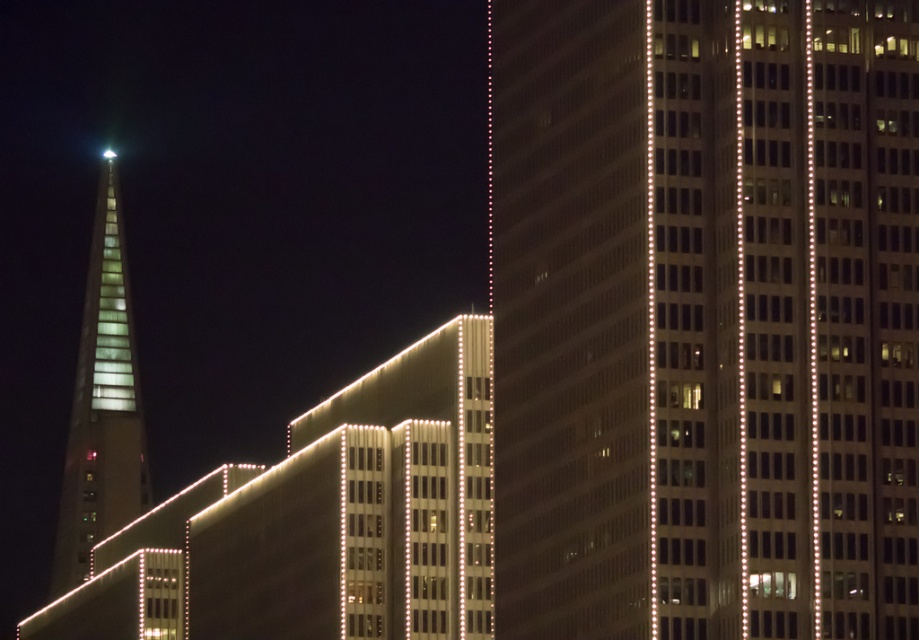
Question: Is glassy reflective skyscraper at center to the left of translucent glass tower at left from the viewer's perspective?

Choices:
 (A) no
 (B) yes

Answer: (A)

Question: Which point is farther from the camera taking this photo?

Choices:
 (A) (109, 154)
 (B) (650, 304)

Answer: (A)

Question: Does translucent glass tower at left appear on the right side of white translucent light at upper left?

Choices:
 (A) no
 (B) yes

Answer: (B)

Question: Where is translucent glass tower at left located in relation to white translucent light at upper left in the image?

Choices:
 (A) left
 (B) right

Answer: (B)

Question: Which object is closer to the camera taking this photo?

Choices:
 (A) glassy reflective skyscraper at center
 (B) white translucent light at upper left

Answer: (A)

Question: Which of the following is the farthest from the observer?

Choices:
 (A) pos(577,289)
 (B) pos(101,156)
 (C) pos(78,371)

Answer: (B)